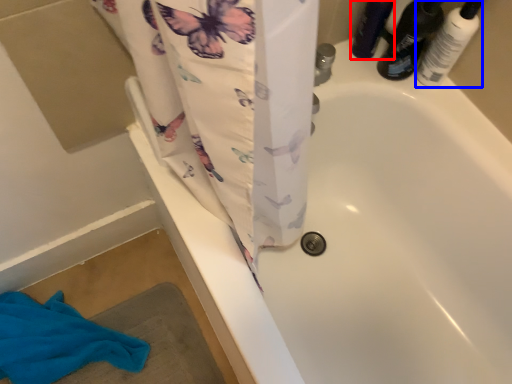
Question: Among these objects, which one is nearest to the camera, toiletry (highlighted by a red box) or toiletry (highlighted by a blue box)?

Choices:
 (A) toiletry
 (B) toiletry

Answer: (B)